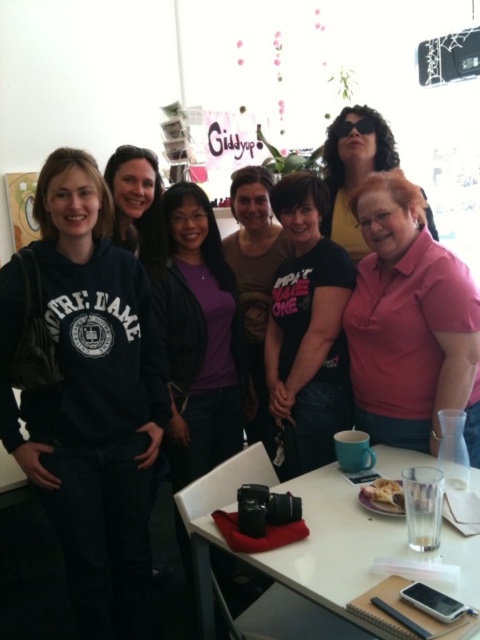
Question: Does matte black shirt at center appear on the right side of matte black sunglasses at upper right?

Choices:
 (A) yes
 (B) no

Answer: (B)

Question: Which object appears farthest from the camera in this image?

Choices:
 (A) pink matte shirt at lower right
 (B) dark blue sweatshirt at left
 (C) black matte t-shirt at center

Answer: (C)

Question: Which object is the farthest from the matte black shirt at center?

Choices:
 (A) white glossy table at lower center
 (B) matte black hoodie at center
 (C) matte black sunglasses at upper right
 (D) black matte t-shirt at center

Answer: (A)

Question: Can you confirm if dark blue sweatshirt at left is bigger than matte black shirt at center?

Choices:
 (A) no
 (B) yes

Answer: (B)

Question: Which of these objects is positioned farthest from the matte black shirt at center?

Choices:
 (A) white glossy table at lower center
 (B) pink matte shirt at lower right
 (C) matte black hoodie at center

Answer: (A)

Question: Does black matte t-shirt at center have a lesser width compared to matte black hoodie at center?

Choices:
 (A) yes
 (B) no

Answer: (B)